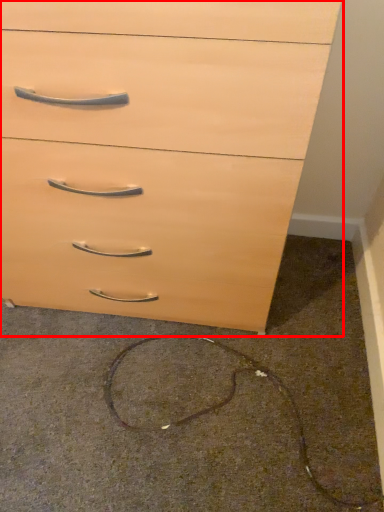
Question: Where is chest of drawers (annotated by the red box) located in relation to concrete in the image?

Choices:
 (A) right
 (B) left

Answer: (B)